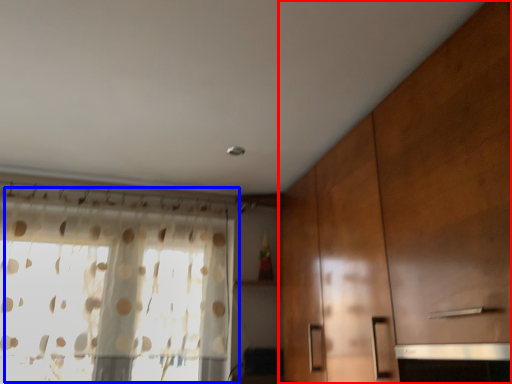
Question: Which object is further to the camera taking this photo, cabinetry (highlighted by a red box) or window (highlighted by a blue box)?

Choices:
 (A) cabinetry
 (B) window

Answer: (B)